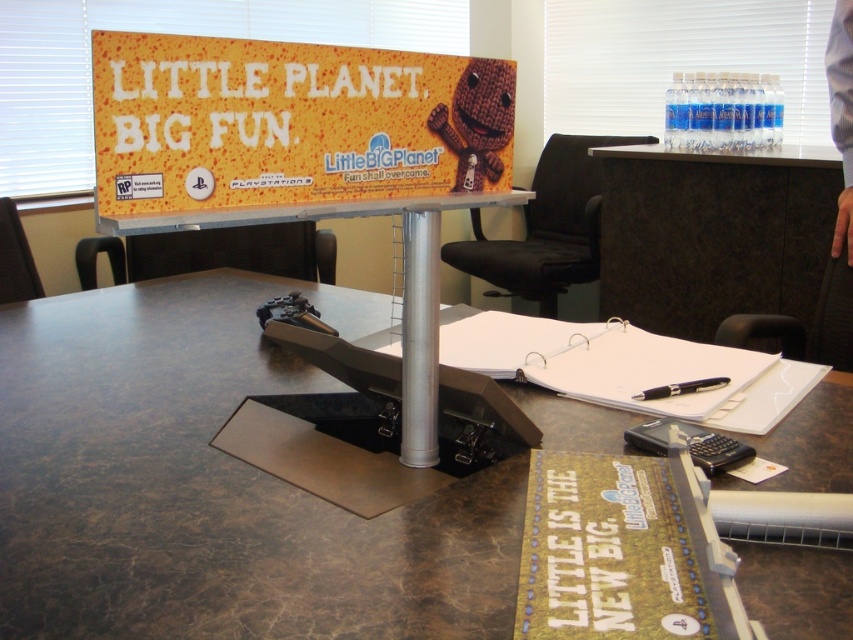
Question: Observing the image, what is the correct spatial positioning of brown marble table at center in reference to orange fabric poster at upper center?

Choices:
 (A) right
 (B) left

Answer: (B)

Question: Considering the real-world distances, which object is closest to the brown marble table at center?

Choices:
 (A) orange fabric poster at upper center
 (B) black fabric swivel chair at center

Answer: (A)

Question: Is black fabric swivel chair at center above black plastic pen at center?

Choices:
 (A) yes
 (B) no

Answer: (A)

Question: Which point is closer to the camera?

Choices:
 (A) brown marble table at center
 (B) black plastic pen at center
 (C) orange fabric poster at upper center

Answer: (A)

Question: Is black fabric swivel chair at center positioned before black plastic pen at center?

Choices:
 (A) yes
 (B) no

Answer: (B)

Question: Estimate the real-world distances between objects in this image. Which object is closer to the orange fabric poster at upper center?

Choices:
 (A) brown marble table at center
 (B) black fabric swivel chair at center
 (C) black plastic pen at center

Answer: (A)